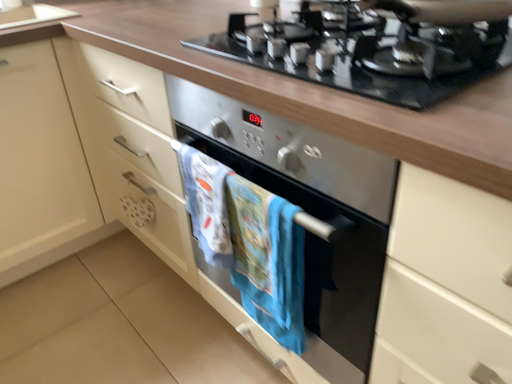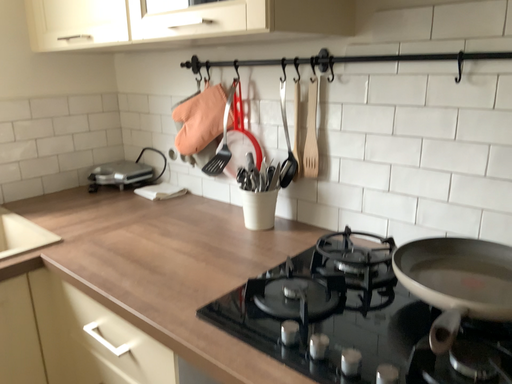
Question: How did the camera likely rotate when shooting the video?

Choices:
 (A) rotated downward
 (B) rotated upward

Answer: (B)